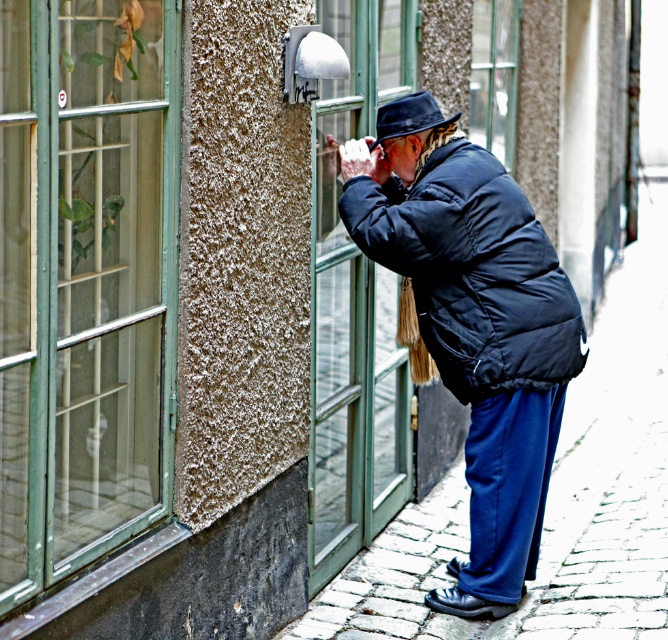
Who is positioned more to the right, green glass window at left or black felt hat at center?

Positioned to the right is black felt hat at center.

Which is behind, point (73, 413) or point (375, 124)?

The point (375, 124) is more distant.

What are the coordinates of `green glass window at left` in the screenshot? It's located at (84, 292).

Is green glass window at center taller than matte black jacket at center?

Yes.

Between point (334, 161) and point (514, 243), which one is positioned behind?

The point (334, 161) is more distant.

Where is `green glass window at center`? The image size is (668, 640). green glass window at center is located at coordinates (355, 304).

Can you confirm if matte black jacket at center is positioned to the right of clear glass window at center?

Incorrect, matte black jacket at center is not on the right side of clear glass window at center.

Which is more to the right, matte black jacket at center or clear glass window at center?

From the viewer's perspective, clear glass window at center appears more on the right side.

This screenshot has height=640, width=668. I want to click on matte black jacket at center, so pos(472,272).